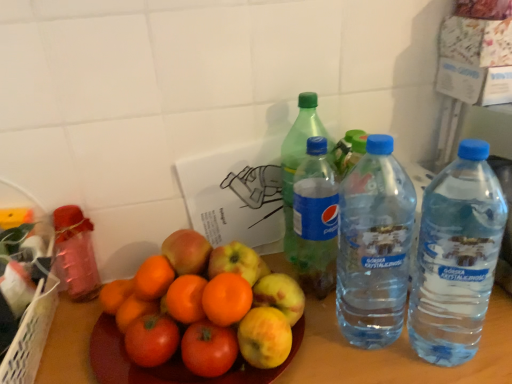
In order to face orange matte at center, should I rotate leftwards or rightwards?

You should rotate left by 7.035 degrees.

You are a GUI agent. You are given a task and a screenshot of the screen. Output one action in this format:
    pyautogui.click(x=<x>, y=<y>)
    Task: Click on the green plastic bottle at center, which is the fourth bottle in right-to-left order
    Image resolution: width=512 pixels, height=384 pixels.
    Given the screenshot: What is the action you would take?
    pyautogui.click(x=298, y=161)

This screenshot has height=384, width=512. What are the coordinates of `green plastic bottle at center, the 3th bottle viewed from the left` in the screenshot? It's located at (316, 219).

Between orange matte at center and clear plastic water bottle at right, placed as the 2th bottle when sorted from right to left, which one has smaller width?

clear plastic water bottle at right, placed as the 2th bottle when sorted from right to left.

Identify the location of orange behind the clear plastic water bottle at right, arranged as the 4th bottle when viewed from the left. The height and width of the screenshot is (384, 512). click(x=204, y=314).

From the picture: Considering the positions of objects orange matte at center and clear plastic water bottle at right, arranged as the 4th bottle when viewed from the left, in the image provided, who is more to the left, orange matte at center or clear plastic water bottle at right, arranged as the 4th bottle when viewed from the left,?

orange matte at center.

From the image's perspective, would you say orange matte at center is shown under clear plastic water bottle at right, arranged as the 4th bottle when viewed from the left?

Yes, from the image's perspective, orange matte at center is below clear plastic water bottle at right, arranged as the 4th bottle when viewed from the left.

Is green plastic bottle at center, arranged as the third bottle when viewed from the right, smaller than orange matte at center?

No.

Considering the positions of objects green plastic bottle at center, the 3th bottle viewed from the left, and orange matte at center in the image provided, who is more to the left, green plastic bottle at center, the 3th bottle viewed from the left, or orange matte at center?

From the viewer's perspective, orange matte at center appears more on the left side.

Is orange matte at center inside green plastic bottle at center, the 3th bottle viewed from the left?

Actually, orange matte at center is outside green plastic bottle at center, the 3th bottle viewed from the left.

Is green plastic bottle at center, the 3th bottle viewed from the left, oriented away from orange matte at center?

green plastic bottle at center, the 3th bottle viewed from the left, is not turned away from orange matte at center.

From the image's perspective, does metallic pink bottle at left, which is counted as the 1th bottle, starting from the left, appear lower than transparent plastic bottle at right, the 5th bottle positioned from the left?

Correct, metallic pink bottle at left, which is counted as the 1th bottle, starting from the left, appears lower than transparent plastic bottle at right, the 5th bottle positioned from the left, in the image.

Choose the correct answer: Is metallic pink bottle at left, which is counted as the 1th bottle, starting from the left, inside transparent plastic bottle at right, which ranks as the first bottle in right-to-left order, or outside it?

The correct answer is: outside.

Does metallic pink bottle at left, which appears as the fifth bottle when viewed from the right, appear on the right side of transparent plastic bottle at right, which ranks as the first bottle in right-to-left order?

In fact, metallic pink bottle at left, which appears as the fifth bottle when viewed from the right, is to the left of transparent plastic bottle at right, which ranks as the first bottle in right-to-left order.

Considering the sizes of objects metallic pink bottle at left, which is counted as the 1th bottle, starting from the left, and transparent plastic bottle at right, which ranks as the first bottle in right-to-left order, in the image provided, who is thinner, metallic pink bottle at left, which is counted as the 1th bottle, starting from the left, or transparent plastic bottle at right, which ranks as the first bottle in right-to-left order,?

metallic pink bottle at left, which is counted as the 1th bottle, starting from the left.

From the image's perspective, which is above, clear plastic water bottle at right, arranged as the 4th bottle when viewed from the left, or orange matte at center?

clear plastic water bottle at right, arranged as the 4th bottle when viewed from the left, appears higher in the image.

Is clear plastic water bottle at right, placed as the 2th bottle when sorted from right to left, outside of orange matte at center?

Yes.

Can you confirm if clear plastic water bottle at right, placed as the 2th bottle when sorted from right to left, is bigger than orange matte at center?

Correct, clear plastic water bottle at right, placed as the 2th bottle when sorted from right to left, is larger in size than orange matte at center.

Considering the positions of points (368, 194) and (237, 304), is point (368, 194) closer to camera compared to point (237, 304)?

Yes, it is in front of point (237, 304).

Can you tell me how much orange matte at center and transparent plastic bottle at right, which ranks as the first bottle in right-to-left order, differ in facing direction?

The angular difference between orange matte at center and transparent plastic bottle at right, which ranks as the first bottle in right-to-left order, is 2.09 degrees.

Is the position of orange matte at center more distant than that of transparent plastic bottle at right, which ranks as the first bottle in right-to-left order?

Yes, the depth of orange matte at center is greater than that of transparent plastic bottle at right, which ranks as the first bottle in right-to-left order.

Does orange matte at center have a greater height compared to transparent plastic bottle at right, which ranks as the first bottle in right-to-left order?

No.

Would you say orange matte at center is inside or outside transparent plastic bottle at right, the 5th bottle positioned from the left?

orange matte at center lies outside transparent plastic bottle at right, the 5th bottle positioned from the left.

From a real-world perspective, is green plastic bottle at center, arranged as the third bottle when viewed from the right, over green plastic bottle at center, which ranks as the 2th bottle in left-to-right order?

Incorrect, from a real-world perspective, green plastic bottle at center, arranged as the third bottle when viewed from the right, is lower than green plastic bottle at center, which ranks as the 2th bottle in left-to-right order.

From the picture: From the image's perspective, is green plastic bottle at center, the 3th bottle viewed from the left, located beneath green plastic bottle at center, which ranks as the 2th bottle in left-to-right order?

Yes, from the image's perspective, green plastic bottle at center, the 3th bottle viewed from the left, is beneath green plastic bottle at center, which ranks as the 2th bottle in left-to-right order.

Considering the positions of objects green plastic bottle at center, the 3th bottle viewed from the left, and green plastic bottle at center, which is the fourth bottle in right-to-left order, in the image provided, who is behind, green plastic bottle at center, the 3th bottle viewed from the left, or green plastic bottle at center, which is the fourth bottle in right-to-left order,?

Positioned behind is green plastic bottle at center, which is the fourth bottle in right-to-left order.

Is green plastic bottle at center, which ranks as the 2th bottle in left-to-right order, inside green plastic bottle at center, the 3th bottle viewed from the left?

No, green plastic bottle at center, the 3th bottle viewed from the left, does not contain green plastic bottle at center, which ranks as the 2th bottle in left-to-right order.

In the image, is metallic pink bottle at left, which is counted as the 1th bottle, starting from the left, on the left side or the right side of green plastic bottle at center, which ranks as the 2th bottle in left-to-right order?

From the image, it's evident that metallic pink bottle at left, which is counted as the 1th bottle, starting from the left, is to the left of green plastic bottle at center, which ranks as the 2th bottle in left-to-right order.

From a real-world perspective, is metallic pink bottle at left, which appears as the fifth bottle when viewed from the right, physically located above or below green plastic bottle at center, which ranks as the 2th bottle in left-to-right order?

metallic pink bottle at left, which appears as the fifth bottle when viewed from the right, is below green plastic bottle at center, which ranks as the 2th bottle in left-to-right order.

Based on the photo, from the image's perspective, which one is positioned higher, metallic pink bottle at left, which appears as the fifth bottle when viewed from the right, or green plastic bottle at center, which ranks as the 2th bottle in left-to-right order?

green plastic bottle at center, which ranks as the 2th bottle in left-to-right order, is shown above in the image.

Does metallic pink bottle at left, which is counted as the 1th bottle, starting from the left, have a larger size compared to green plastic bottle at center, which ranks as the 2th bottle in left-to-right order?

No, metallic pink bottle at left, which is counted as the 1th bottle, starting from the left, is not bigger than green plastic bottle at center, which ranks as the 2th bottle in left-to-right order.

In order to click on orange lying below the clear plastic water bottle at right, placed as the 2th bottle when sorted from right to left (from the image's perspective) in this screenshot , I will do `click(204, 314)`.

This screenshot has height=384, width=512. I want to click on orange in front of the green plastic bottle at center, the 3th bottle viewed from the left, so click(204, 314).

Looking at this image, when comparing their distances from metallic pink bottle at left, which is counted as the 1th bottle, starting from the left, does orange matte at center or green plastic bottle at center, which ranks as the 2th bottle in left-to-right order, seem closer?

orange matte at center is closer to metallic pink bottle at left, which is counted as the 1th bottle, starting from the left.

Which object lies further to the anchor point clear plastic water bottle at right, placed as the 2th bottle when sorted from right to left, orange matte at center or green plastic bottle at center, which ranks as the 2th bottle in left-to-right order?

orange matte at center.

Looking at this image, which object lies further to the anchor point green plastic bottle at center, arranged as the third bottle when viewed from the right, clear plastic water bottle at right, placed as the 2th bottle when sorted from right to left, or metallic pink bottle at left, which is counted as the 1th bottle, starting from the left?

metallic pink bottle at left, which is counted as the 1th bottle, starting from the left, is positioned further to the anchor green plastic bottle at center, arranged as the third bottle when viewed from the right.

Based on their spatial positions, is transparent plastic bottle at right, the 5th bottle positioned from the left, or metallic pink bottle at left, which appears as the fifth bottle when viewed from the right, further from clear plastic water bottle at right, placed as the 2th bottle when sorted from right to left?

metallic pink bottle at left, which appears as the fifth bottle when viewed from the right, lies further to clear plastic water bottle at right, placed as the 2th bottle when sorted from right to left, than the other object.

Estimate the real-world distances between objects in this image. Which object is further from metallic pink bottle at left, which appears as the fifth bottle when viewed from the right, green plastic bottle at center, arranged as the third bottle when viewed from the right, or clear plastic water bottle at right, arranged as the 4th bottle when viewed from the left?

clear plastic water bottle at right, arranged as the 4th bottle when viewed from the left, lies further to metallic pink bottle at left, which appears as the fifth bottle when viewed from the right, than the other object.

Based on the photo, when comparing their distances from green plastic bottle at center, the 3th bottle viewed from the left, does transparent plastic bottle at right, the 5th bottle positioned from the left, or clear plastic water bottle at right, arranged as the 4th bottle when viewed from the left, seem further?

transparent plastic bottle at right, the 5th bottle positioned from the left, is positioned further to the anchor green plastic bottle at center, the 3th bottle viewed from the left.

When comparing their distances from clear plastic water bottle at right, placed as the 2th bottle when sorted from right to left, does metallic pink bottle at left, which appears as the fifth bottle when viewed from the right, or green plastic bottle at center, which ranks as the 2th bottle in left-to-right order, seem further?

Based on the image, metallic pink bottle at left, which appears as the fifth bottle when viewed from the right, appears to be further to clear plastic water bottle at right, placed as the 2th bottle when sorted from right to left.

Estimate the real-world distances between objects in this image. Which object is closer to transparent plastic bottle at right, the 5th bottle positioned from the left, green plastic bottle at center, which ranks as the 2th bottle in left-to-right order, or green plastic bottle at center, the 3th bottle viewed from the left?

The object closer to transparent plastic bottle at right, the 5th bottle positioned from the left, is green plastic bottle at center, the 3th bottle viewed from the left.

The image size is (512, 384). I want to click on orange between metallic pink bottle at left, which appears as the fifth bottle when viewed from the right, and clear plastic water bottle at right, arranged as the 4th bottle when viewed from the left, in the horizontal direction, so (x=204, y=314).

You are a GUI agent. You are given a task and a screenshot of the screen. Output one action in this format:
    pyautogui.click(x=<x>, y=<y>)
    Task: Click on the orange between metallic pink bottle at left, which is counted as the 1th bottle, starting from the left, and green plastic bottle at center, which ranks as the 2th bottle in left-to-right order
    Image resolution: width=512 pixels, height=384 pixels.
    Given the screenshot: What is the action you would take?
    pyautogui.click(x=204, y=314)

The image size is (512, 384). I want to click on bottle situated between green plastic bottle at center, the 3th bottle viewed from the left, and transparent plastic bottle at right, which ranks as the first bottle in right-to-left order, from left to right, so click(x=374, y=246).

You are a GUI agent. You are given a task and a screenshot of the screen. Output one action in this format:
    pyautogui.click(x=<x>, y=<y>)
    Task: Click on the bottle between clear plastic water bottle at right, arranged as the 4th bottle when viewed from the left, and green plastic bottle at center, which ranks as the 2th bottle in left-to-right order, along the z-axis
    The height and width of the screenshot is (384, 512).
    Given the screenshot: What is the action you would take?
    pyautogui.click(x=316, y=219)